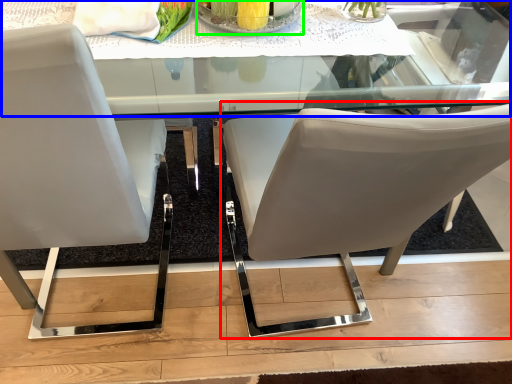
Question: Which object is positioned closest to chair (highlighted by a red box)? Select from round table (highlighted by a blue box) and glass plate (highlighted by a green box).

Choices:
 (A) round table
 (B) glass plate

Answer: (A)